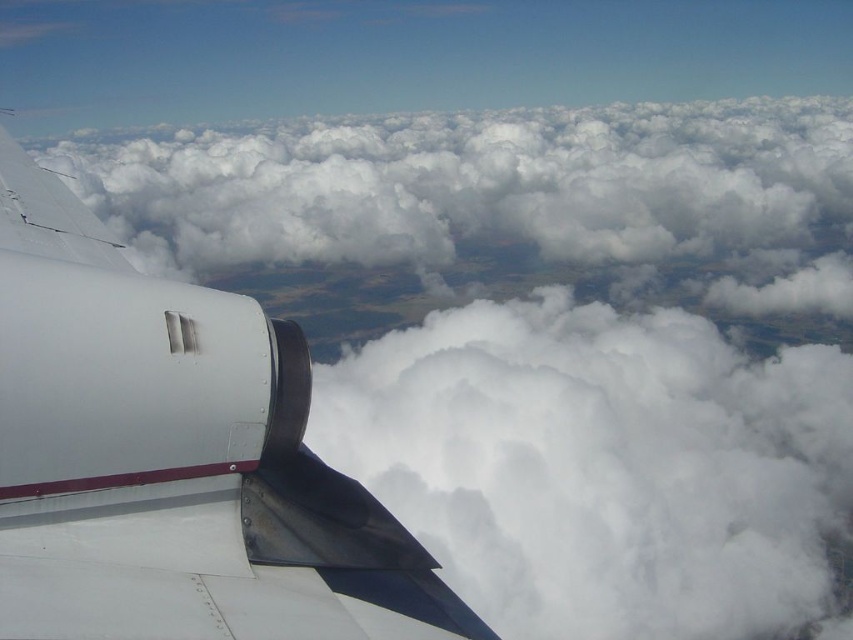
You are a passenger sitting in the aircraft and want to know how far the white matte airplane wing at left is from your seat. Can you determine the distance based on the scene?

The white matte airplane wing at left is 3.64 meters away from the viewer, so the distance between your seat and the wing is approximately 3.64 meters.

You are a pilot checking the clouds ahead. You see the white fluffy cloud at center and the white fluffy cloud at upper center. Which one is wider?

The white fluffy cloud at upper center is wider than the white fluffy cloud at center.